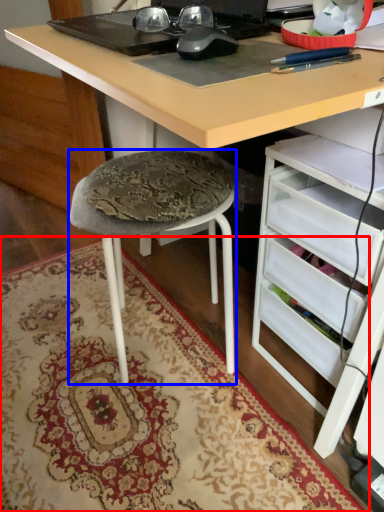
Question: Among these objects, which one is farthest to the camera, mat (highlighted by a red box) or stool (highlighted by a blue box)?

Choices:
 (A) mat
 (B) stool

Answer: (B)